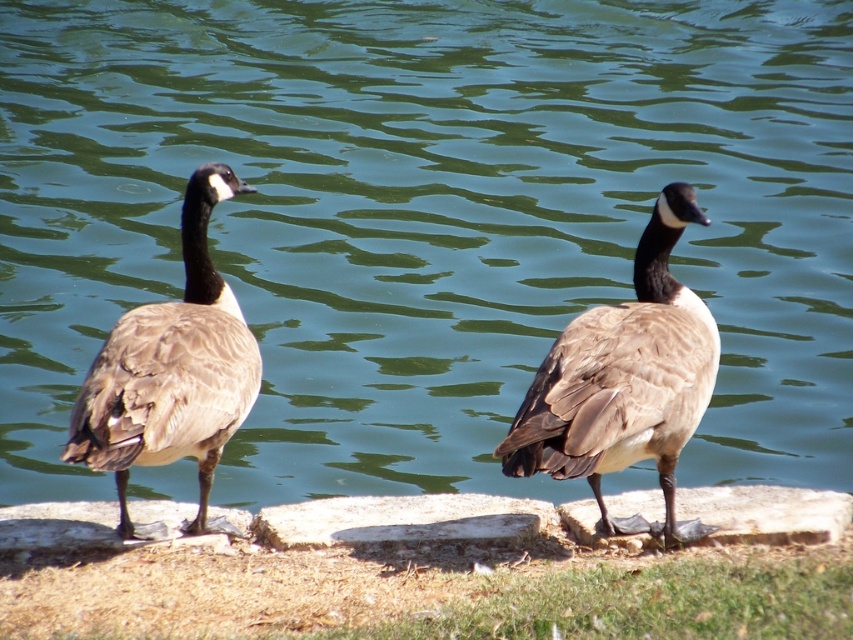
Question: Does brown feathered duck at center have a greater width compared to brown feathered duck at left?

Choices:
 (A) no
 (B) yes

Answer: (B)

Question: Is brown feathered duck at center bigger than brown feathered duck at left?

Choices:
 (A) yes
 (B) no

Answer: (A)

Question: Which point is closer to the camera?

Choices:
 (A) brown feathered duck at center
 (B) brown feathered duck at left

Answer: (B)

Question: Which object appears closest to the camera in this image?

Choices:
 (A) brown feathered duck at center
 (B) brown feathered duck at left

Answer: (B)

Question: Does brown feathered duck at center appear over brown feathered duck at left?

Choices:
 (A) yes
 (B) no

Answer: (B)